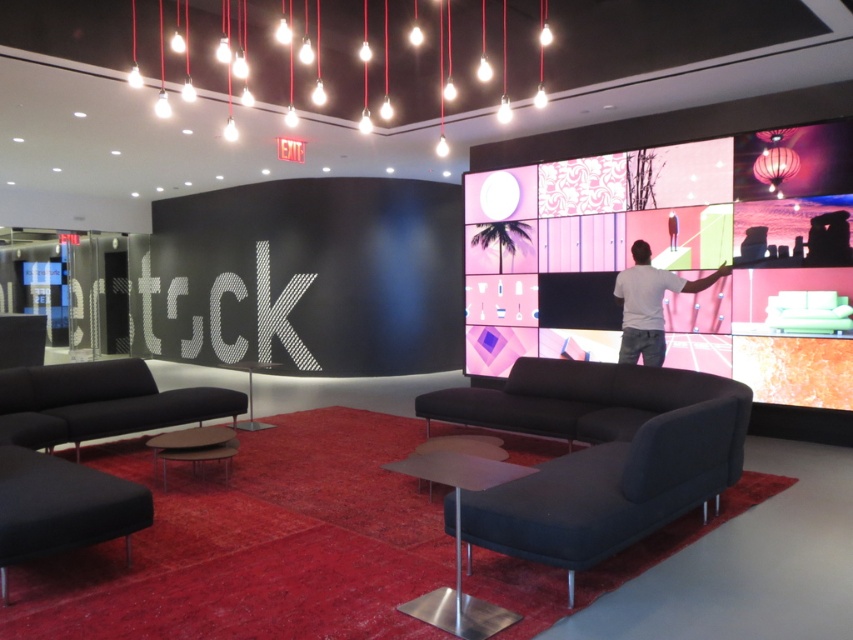
You are a guest at a tech exhibition and want to move from the black fabric couch at left to the LED screen. The exhibition requires that you maintain a distance of at least 3 meters from the screen to avoid interference with the display. Can you safely move to the screen without violating this rule?

The distance between the black fabric couch at left and the LED screen is 4.20 meters, which is greater than the required 3 meters. Therefore, you can safely move to the screen without violating the exhibition rules.

You are standing at the entrance of the lounge and want to sit on the black fabric couch at left. Which direction should you move to reach it?

The black fabric couch at left is located at point 0.630 on the x axis and 0.117 on the y axis, so you should move towards the left side of the lounge to reach it.

You are standing in the lounge area and want to place a gray matte shirt at upper right on a shelf that is 0.5 meters wide. Can the shirt fit on the shelf?

The gray matte shirt at upper right is located at point [648,304], so its dimensions are not provided. Therefore, it is impossible to determine if it will fit on the 0.5 meter wide shelf.